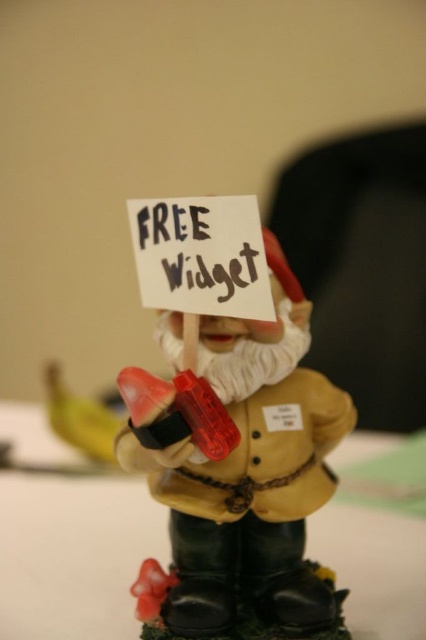
Question: Can you confirm if green matte table at center is positioned above yellow matte banana at lower left?

Choices:
 (A) no
 (B) yes

Answer: (A)

Question: Among these objects, which one is farthest from the camera?

Choices:
 (A) matte yellow figurine at center
 (B) yellow matte banana at lower left
 (C) green matte table at center

Answer: (B)

Question: Does matte yellow figurine at center appear on the left side of yellow matte banana at lower left?

Choices:
 (A) yes
 (B) no

Answer: (B)

Question: In this image, where is matte yellow figurine at center located relative to green matte table at center?

Choices:
 (A) below
 (B) above

Answer: (B)

Question: Which is nearer to the green matte table at center?

Choices:
 (A) matte yellow figurine at center
 (B) yellow matte banana at lower left

Answer: (B)

Question: Which point is closer to the camera?

Choices:
 (A) yellow matte banana at lower left
 (B) green matte table at center

Answer: (B)